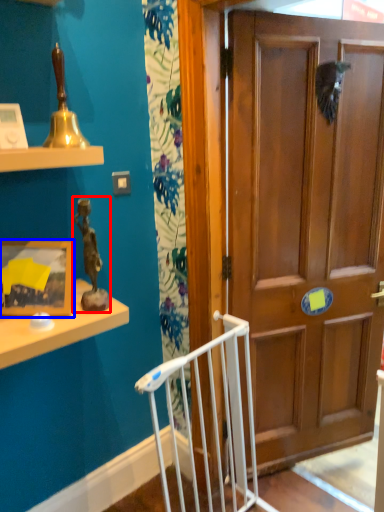
Question: Among these objects, which one is farthest to the camera, toy (highlighted by a red box) or picture frame (highlighted by a blue box)?

Choices:
 (A) toy
 (B) picture frame

Answer: (B)